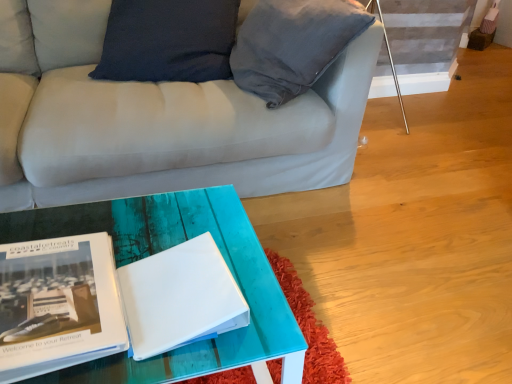
Question: Would you say matte black book at lower left is outside white matte book at center?

Choices:
 (A) no
 (B) yes

Answer: (B)

Question: From the image's perspective, is matte black book at lower left on white matte book at center?

Choices:
 (A) no
 (B) yes

Answer: (A)

Question: Is matte black book at lower left next to white matte book at center?

Choices:
 (A) yes
 (B) no

Answer: (B)

Question: From the image's perspective, would you say matte black book at lower left is shown under white matte book at center?

Choices:
 (A) no
 (B) yes

Answer: (B)

Question: Does matte black book at lower left have a lesser width compared to white matte book at center?

Choices:
 (A) no
 (B) yes

Answer: (A)

Question: From a real-world perspective, is matte black book at lower left below white matte book at center?

Choices:
 (A) no
 (B) yes

Answer: (B)

Question: Is white matte book at center surrounding matte black book at lower left?

Choices:
 (A) no
 (B) yes

Answer: (A)

Question: From the image's perspective, is white matte book at center located beneath matte black book at lower left?

Choices:
 (A) no
 (B) yes

Answer: (A)

Question: Is white matte book at center outside matte black book at lower left?

Choices:
 (A) no
 (B) yes

Answer: (B)

Question: Are white matte book at center and matte black book at lower left making contact?

Choices:
 (A) no
 (B) yes

Answer: (A)

Question: From a real-world perspective, is white matte book at center located beneath matte black book at lower left?

Choices:
 (A) no
 (B) yes

Answer: (A)

Question: From the image's perspective, is white matte book at center on matte black book at lower left?

Choices:
 (A) no
 (B) yes

Answer: (B)

Question: From a real-world perspective, relative to white matte book at center, is matte black book at lower left vertically above or below?

Choices:
 (A) above
 (B) below

Answer: (B)